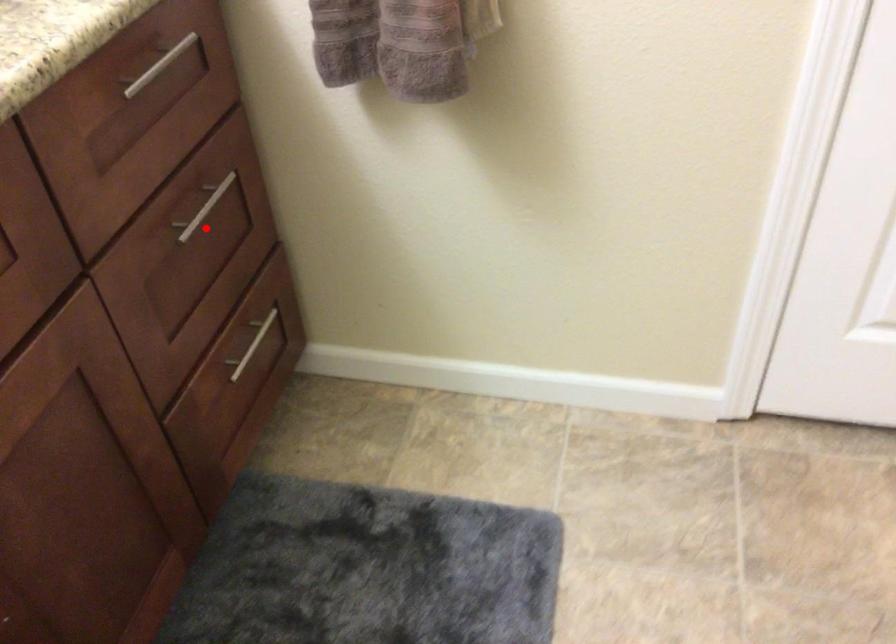
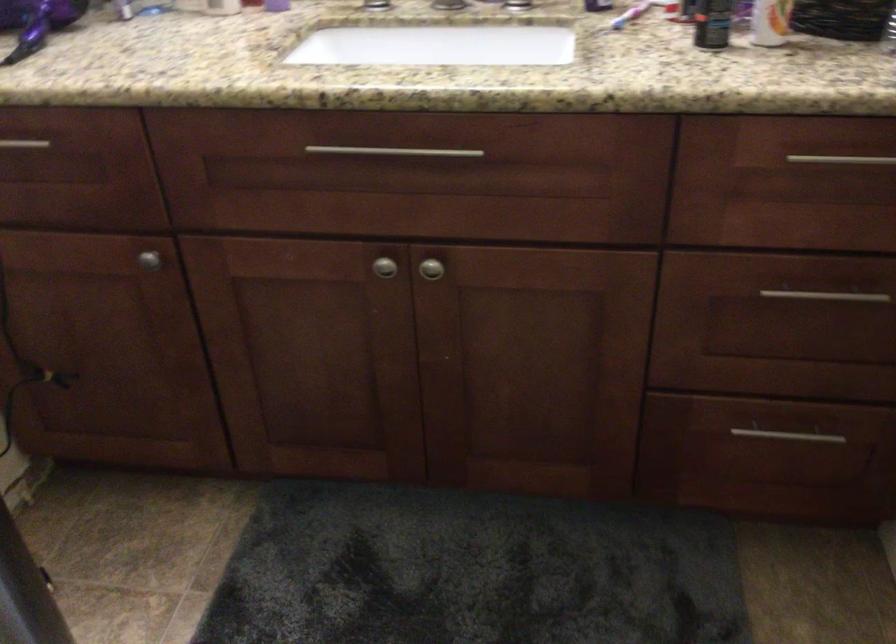
Question: I am providing you with two images of the same scene from different viewpoints. Image1 has a red point marked. In image2, the corresponding 3D location appears at what relative position? Reply with the corresponding letter.

Choices:
 (A) Closer
 (B) Farther

Answer: (B)